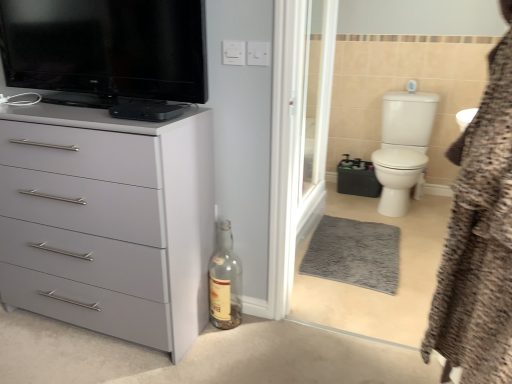
You are a GUI agent. You are given a task and a screenshot of the screen. Output one action in this format:
    pyautogui.click(x=<x>, y=<y>)
    Task: Click on the vacant area that is in front of clear glass bottle at lower center
    Image resolution: width=512 pixels, height=384 pixels.
    Given the screenshot: What is the action you would take?
    pyautogui.click(x=221, y=347)